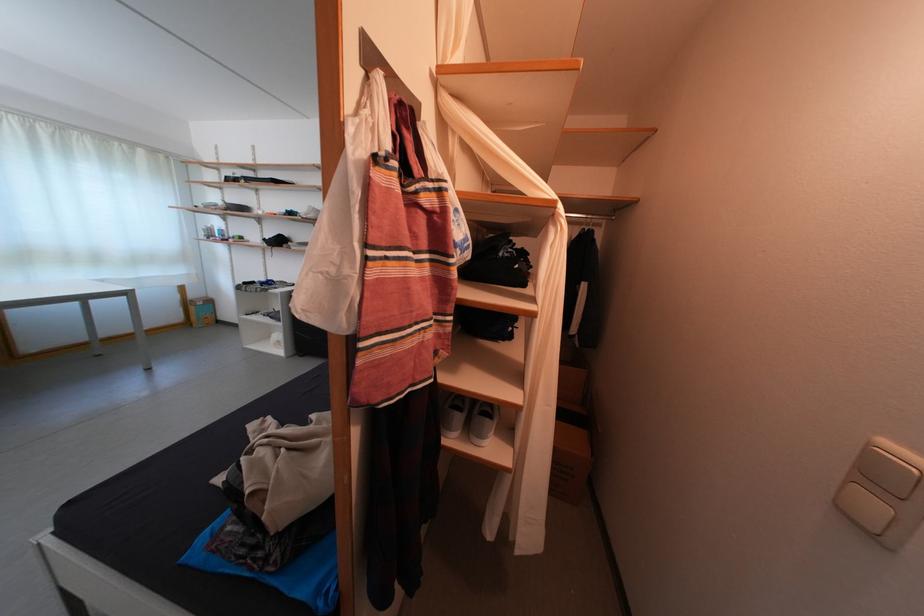
Which object does [201,312] point to?

This point indicates the small cardboard box.